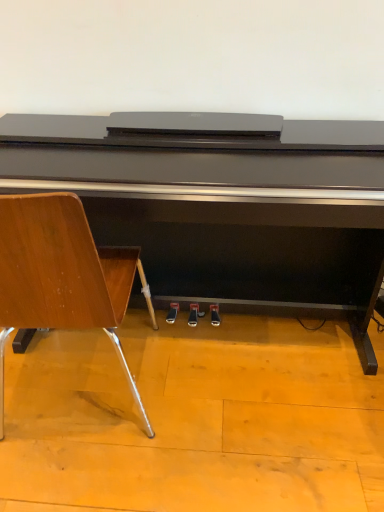
The height and width of the screenshot is (512, 384). Identify the location of vacant area located to the right-hand side of wooden chair at left. (224, 394).